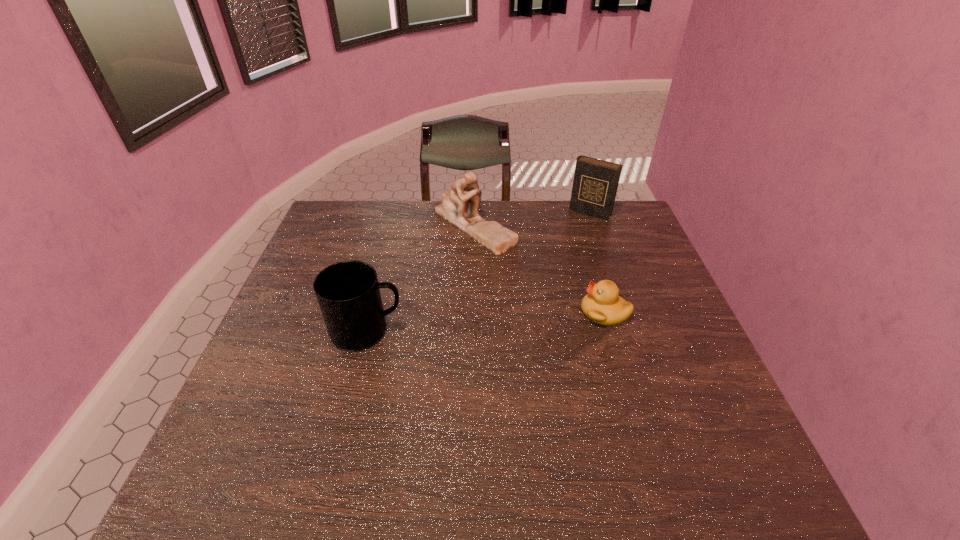
Image resolution: width=960 pixels, height=540 pixels. What are the coordinates of `the leftmost object` in the screenshot? It's located at (348, 292).

Locate an element on the screen. the shortest object is located at coordinates (602, 304).

You are a GUI agent. You are given a task and a screenshot of the screen. Output one action in this format:
    pyautogui.click(x=<x>, y=<y>)
    Task: Click on the diary
    This screenshot has width=960, height=540.
    Given the screenshot: What is the action you would take?
    595,184

Find the location of a particular element. Image resolution: width=960 pixels, height=540 pixels. the second object from left to right is located at coordinates (455, 208).

Find the location of a particular element. The width and height of the screenshot is (960, 540). free space located on the side of the leftmost object with the handle is located at coordinates (517, 331).

You are a GUI agent. You are given a task and a screenshot of the screen. Output one action in this format:
    pyautogui.click(x=<x>, y=<y>)
    Task: Click on the vacant point located on the front-facing side of the shortest object
    This screenshot has height=540, width=960.
    Given the screenshot: What is the action you would take?
    pyautogui.click(x=508, y=312)

This screenshot has width=960, height=540. Find the location of `free space located 0.330m on the front-facing side of the shortest object`. free space located 0.330m on the front-facing side of the shortest object is located at coordinates (454, 312).

I want to click on vacant space situated 0.390m on the front-facing side of the shortest object, so click(431, 312).

Locate an element on the screen. This screenshot has height=540, width=960. vacant region located 0.390m on the front cover of the diary is located at coordinates (532, 287).

This screenshot has width=960, height=540. Find the location of `vacant space located on the front cover of the diary`. vacant space located on the front cover of the diary is located at coordinates (565, 242).